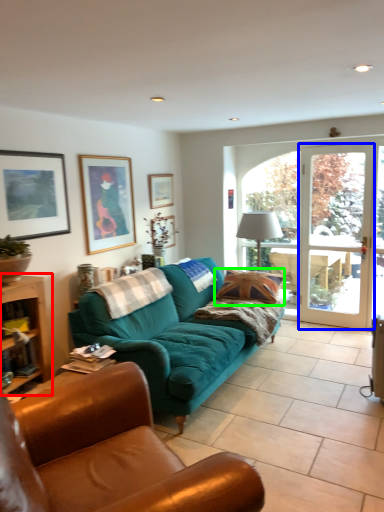
Question: Considering the real-world distances, which object is closest to table (highlighted by a red box)? screen door (highlighted by a blue box) or pillow (highlighted by a green box).

Choices:
 (A) screen door
 (B) pillow

Answer: (B)